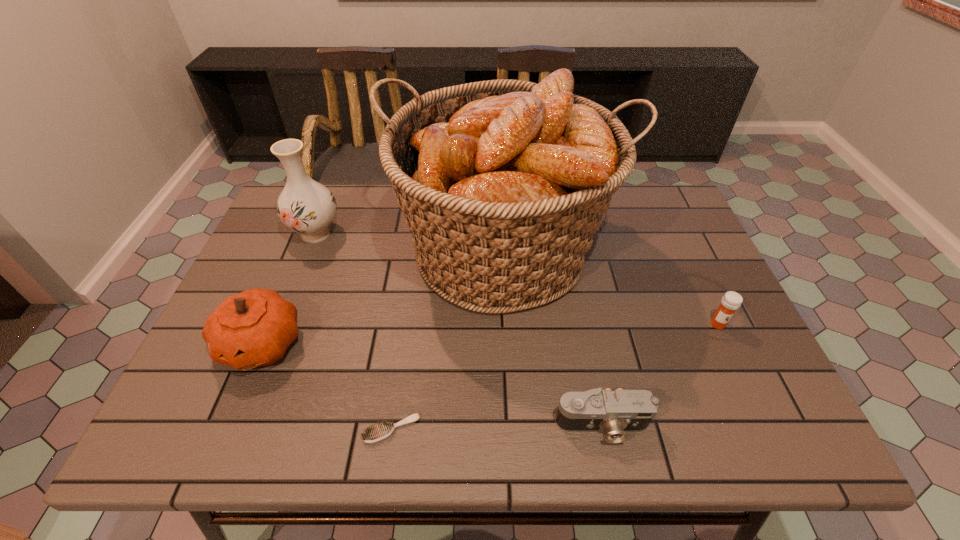
Locate an element on the screen. Image resolution: width=960 pixels, height=540 pixels. basket is located at coordinates (503, 183).

Where is `vase`? This screenshot has height=540, width=960. vase is located at coordinates (305, 206).

Where is `the fourth shortest object`? This screenshot has height=540, width=960. the fourth shortest object is located at coordinates (254, 328).

Locate an element on the screen. the rightmost object is located at coordinates (731, 301).

Where is `camera`? The height and width of the screenshot is (540, 960). camera is located at coordinates (616, 412).

What are the coordinates of `the shortest object` in the screenshot? It's located at (x=378, y=432).

At what (x,y) coordinates should I click in order to perform the action: click on vacant area situated 0.220m on the right of the tallest object. Please return your answer as a coordinate pair (x, y). The width and height of the screenshot is (960, 540). Looking at the image, I should click on (690, 252).

Where is `free spot located on the right of the second tallest object`? This screenshot has width=960, height=540. free spot located on the right of the second tallest object is located at coordinates (452, 233).

Find the location of a particular element. This screenshot has height=540, width=960. free region located 0.110m on the front-facing side of the fourth shortest object is located at coordinates (226, 430).

Where is `vacant region located 0.200m on the label side of the medicine`? vacant region located 0.200m on the label side of the medicine is located at coordinates (757, 409).